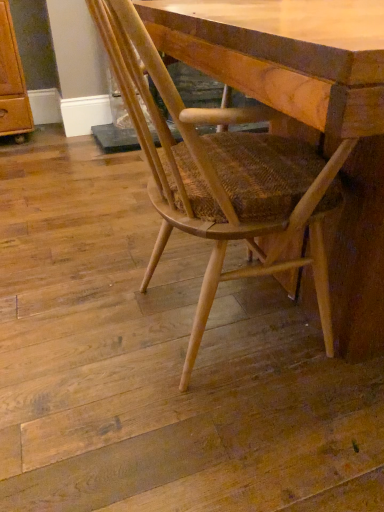
This screenshot has height=512, width=384. Describe the element at coordinates (221, 175) in the screenshot. I see `natural wood chair at center` at that location.

Find the location of a particular element. This screenshot has height=512, width=384. natural wood chair at center is located at coordinates (221, 175).

Identify the location of natural wood chair at center. (221, 175).